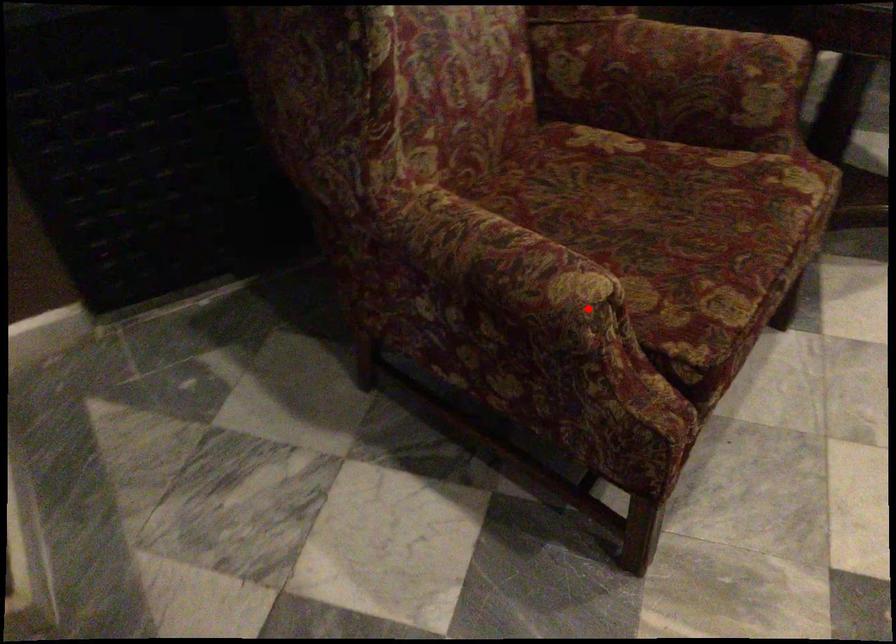
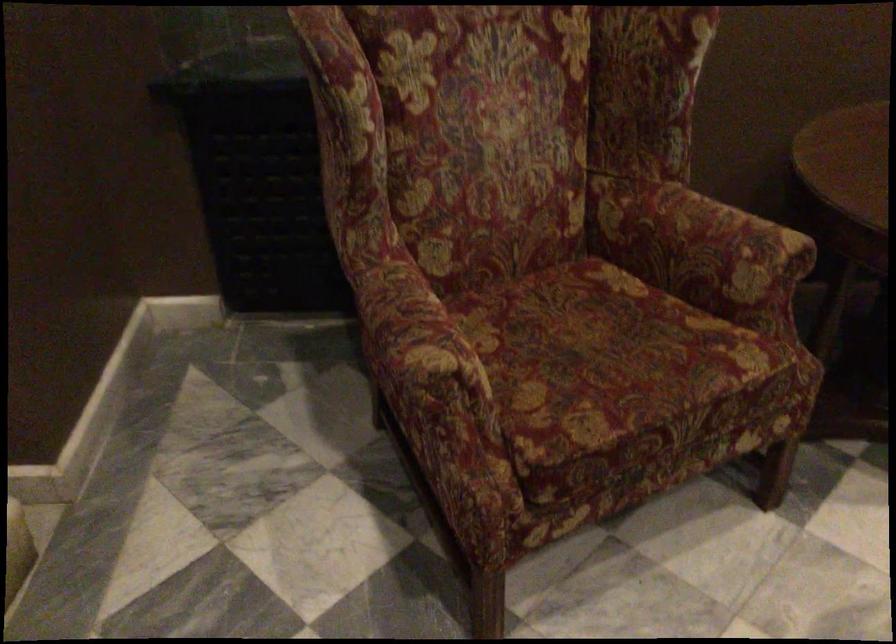
Question: I am providing you with two images of the same scene from different viewpoints. A red point is marked on the first image. Is the red point's position out of view in image 2?

Choices:
 (A) Yes
 (B) No

Answer: (B)